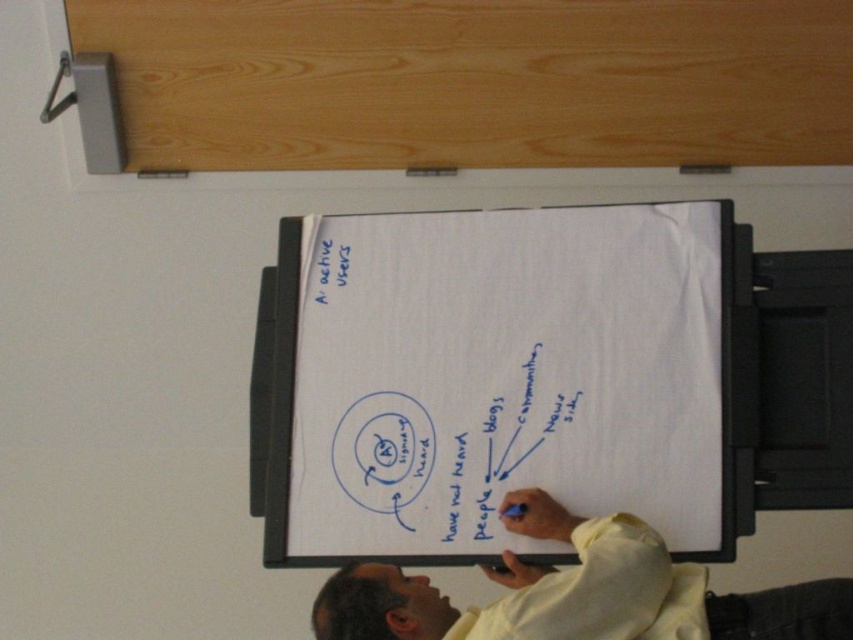
You are an assistant in a meeting. You need to hang a poster that is 1.2 meters tall on the wall where the white paperboard at center is placed. Can the poster fit vertically on the wall without overlapping the light yellow shirt at center?

The white paperboard at center is much taller than the light yellow shirt at center, so the poster of 1.2 meters can fit vertically on the wall without overlapping the light yellow shirt at center.

You are standing in front of the flip chart and need to place a sticky note between the two points labeled point (498, 428) and point (701, 568). Which point should the sticky note be closer to in order to be nearer to the viewer?

The sticky note should be closer to point (498, 428) because it is closer to the viewer compared to point (701, 568).